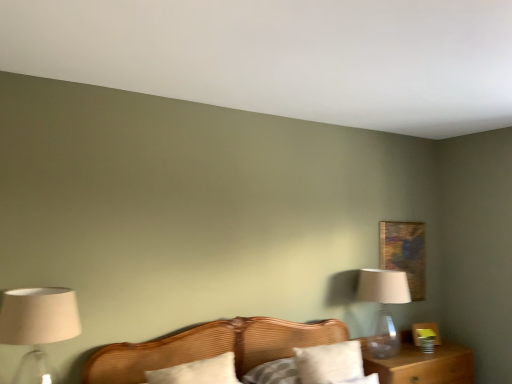
Question: Considering the relative sizes of wooden bed at center and transparent glass table lamp at right in the image provided, is wooden bed at center taller than transparent glass table lamp at right?

Choices:
 (A) no
 (B) yes

Answer: (A)

Question: Is wooden bed at center next to transparent glass table lamp at right and touching it?

Choices:
 (A) yes
 (B) no

Answer: (B)

Question: Is wooden bed at center thinner than transparent glass table lamp at right?

Choices:
 (A) no
 (B) yes

Answer: (A)

Question: From the image's perspective, does wooden bed at center appear lower than transparent glass table lamp at right?

Choices:
 (A) no
 (B) yes

Answer: (B)

Question: From a real-world perspective, is wooden bed at center physically above transparent glass table lamp at right?

Choices:
 (A) yes
 (B) no

Answer: (B)

Question: From a real-world perspective, is white soft pillow at center, the 2th pillow in the right-to-left sequence, above or below brown wooden nightstand at lower right?

Choices:
 (A) below
 (B) above

Answer: (B)

Question: Is white soft pillow at center, marked as the first pillow in a left-to-right arrangement, taller or shorter than brown wooden nightstand at lower right?

Choices:
 (A) tall
 (B) short

Answer: (B)

Question: Is white soft pillow at center, marked as the first pillow in a left-to-right arrangement, bigger or smaller than brown wooden nightstand at lower right?

Choices:
 (A) big
 (B) small

Answer: (B)

Question: Is point (198, 362) positioned closer to the camera than point (393, 357)?

Choices:
 (A) closer
 (B) farther

Answer: (A)

Question: From a real-world perspective, is matte beige lampshade at left physically located above or below wooden bed at center?

Choices:
 (A) above
 (B) below

Answer: (A)

Question: Is matte beige lampshade at left bigger or smaller than wooden bed at center?

Choices:
 (A) small
 (B) big

Answer: (A)

Question: Based on their positions, is matte beige lampshade at left located to the left or right of wooden bed at center?

Choices:
 (A) left
 (B) right

Answer: (A)

Question: Considering the positions of matte beige lampshade at left and wooden bed at center in the image, is matte beige lampshade at left taller or shorter than wooden bed at center?

Choices:
 (A) tall
 (B) short

Answer: (B)

Question: Is white cotton pillow at center, which appears as the 1th pillow when viewed from the right, in front of or behind transparent glass table lamp at right in the image?

Choices:
 (A) behind
 (B) front

Answer: (B)

Question: From the image's perspective, relative to transparent glass table lamp at right, is white cotton pillow at center, the 2th pillow in the left-to-right sequence, above or below?

Choices:
 (A) above
 (B) below

Answer: (B)